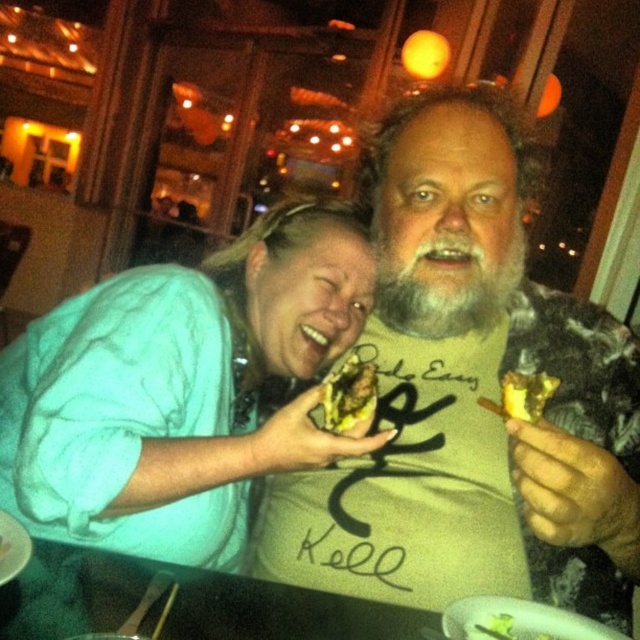
Question: Which point is closer to the camera?

Choices:
 (A) brown crispy bread at center
 (B) brown crumbly bread at right

Answer: (A)

Question: Can you confirm if graybeard at center is wider than brown crumbly bread at right?

Choices:
 (A) yes
 (B) no

Answer: (A)

Question: Which point appears closest to the camera in this image?

Choices:
 (A) (115, 449)
 (B) (545, 380)
 (C) (12, 525)

Answer: (C)

Question: From the image, what is the correct spatial relationship of graybeard at center in relation to brown crispy bread at center?

Choices:
 (A) left
 (B) right

Answer: (B)

Question: Can you confirm if light blue fabric shirt at upper left is bigger than graybeard at center?

Choices:
 (A) no
 (B) yes

Answer: (B)

Question: Which of the following is the farthest from the observer?

Choices:
 (A) (605, 314)
 (B) (10, 428)
 (C) (369, 387)
 (D) (442, 316)

Answer: (A)